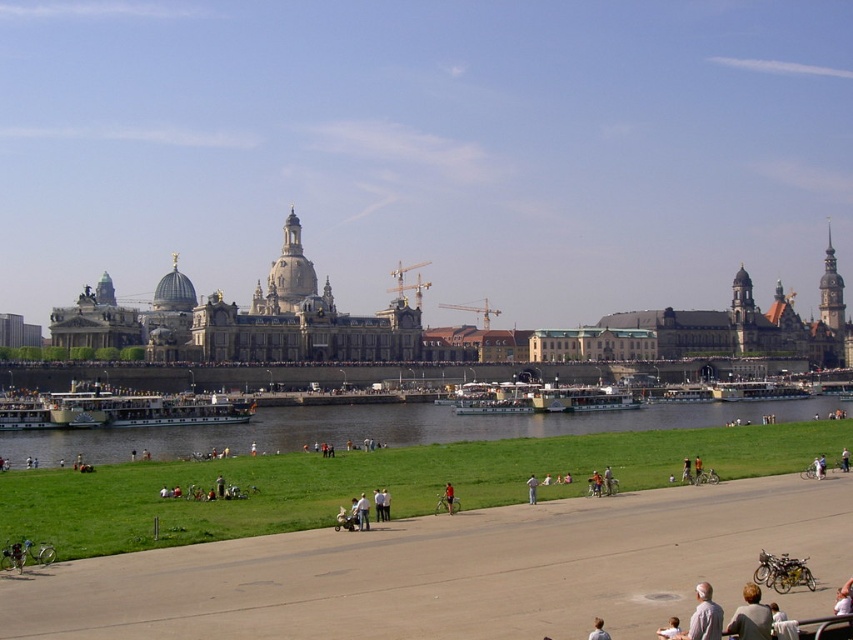
Locate an element on the screen. blonde hair at lower right is located at coordinates (750, 616).

Does blonde hair at lower right appear on the right side of white cotton shirt at center?

Yes, blonde hair at lower right is to the right of white cotton shirt at center.

Who is more distant from viewer, [738,611] or [669,624]?

Point [669,624]

This screenshot has width=853, height=640. Find the location of `blonde hair at lower right`. blonde hair at lower right is located at coordinates pyautogui.click(x=750, y=616).

Can you confirm if blonde hair at lower right is positioned above light blue jeans at center?

No.

Measure the distance between point (746, 637) and camera.

Point (746, 637) and camera are 151.65 feet apart from each other.

The height and width of the screenshot is (640, 853). I want to click on blonde hair at lower right, so click(x=750, y=616).

How far apart are light brown hair at lower right and red shirt at center?

light brown hair at lower right and red shirt at center are 24.65 meters apart.

Can you confirm if light brown hair at lower right is shorter than red shirt at center?

Yes.

Is point (606, 637) in front of point (448, 509)?

Yes, it is.

Image resolution: width=853 pixels, height=640 pixels. Identify the location of light brown hair at lower right. (598, 630).